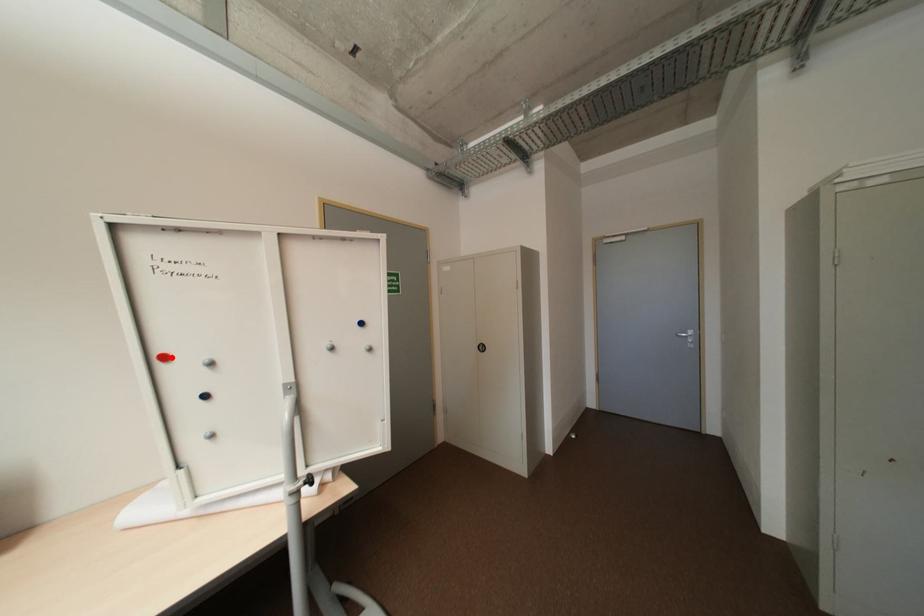
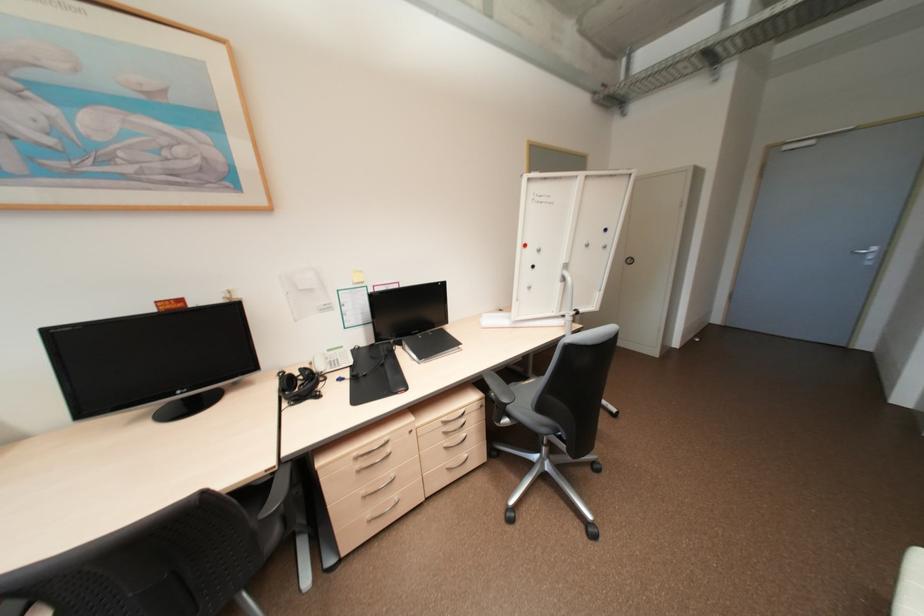
Where in the second image is the point corresponding to the highlighted location from the first image?

(530, 245)